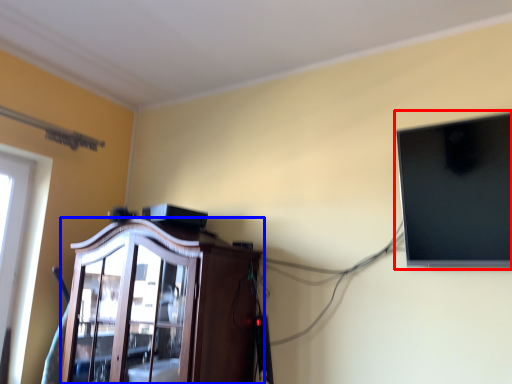
Question: Which object is further to the camera taking this photo, computer monitor (highlighted by a red box) or cabinetry (highlighted by a blue box)?

Choices:
 (A) computer monitor
 (B) cabinetry

Answer: (B)